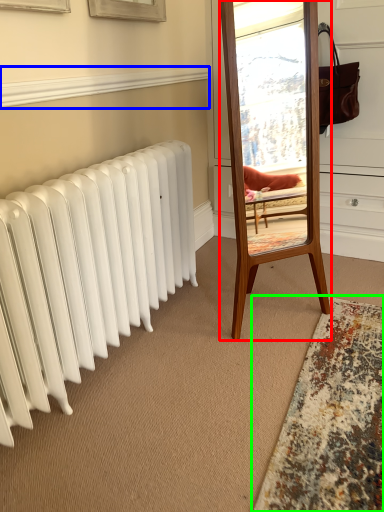
Question: Which object is the closest to the mirror (highlighted by a red box)? Choose among these: window sill (highlighted by a blue box) or mat (highlighted by a green box).

Choices:
 (A) window sill
 (B) mat

Answer: (B)